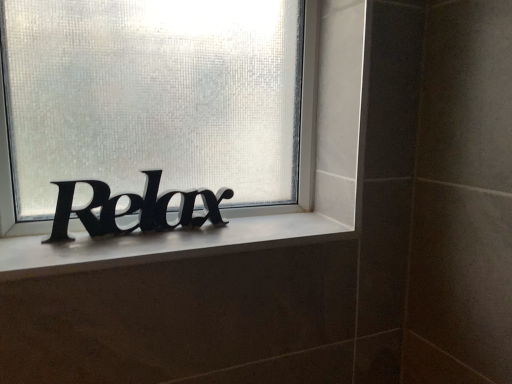
Question: Can you confirm if black matte lettering at center is thinner than black matte sign at center?

Choices:
 (A) no
 (B) yes

Answer: (B)

Question: Is black matte sign at center located within black matte lettering at center?

Choices:
 (A) no
 (B) yes

Answer: (A)

Question: Does black matte lettering at center lie in front of black matte sign at center?

Choices:
 (A) no
 (B) yes

Answer: (A)

Question: Considering the relative positions of black matte lettering at center and black matte sign at center in the image provided, is black matte lettering at center to the left of black matte sign at center from the viewer's perspective?

Choices:
 (A) yes
 (B) no

Answer: (A)

Question: Is the position of black matte lettering at center more distant than that of black matte sign at center?

Choices:
 (A) yes
 (B) no

Answer: (A)

Question: Considering the relative sizes of black matte lettering at center and black matte sign at center in the image provided, is black matte lettering at center wider than black matte sign at center?

Choices:
 (A) yes
 (B) no

Answer: (B)

Question: Is the position of white matte window sill at center more distant than that of black matte sign at center?

Choices:
 (A) no
 (B) yes

Answer: (A)

Question: Is white matte window sill at center thinner than black matte sign at center?

Choices:
 (A) no
 (B) yes

Answer: (A)

Question: Could you tell me if white matte window sill at center is turned towards black matte sign at center?

Choices:
 (A) yes
 (B) no

Answer: (B)

Question: From a real-world perspective, is white matte window sill at center beneath black matte sign at center?

Choices:
 (A) no
 (B) yes

Answer: (B)

Question: Considering the relative sizes of white matte window sill at center and black matte sign at center in the image provided, is white matte window sill at center smaller than black matte sign at center?

Choices:
 (A) no
 (B) yes

Answer: (B)

Question: Is white matte window sill at center shorter than black matte sign at center?

Choices:
 (A) yes
 (B) no

Answer: (A)

Question: Considering the relative sizes of white matte window sill at center and black matte lettering at center in the image provided, is white matte window sill at center bigger than black matte lettering at center?

Choices:
 (A) no
 (B) yes

Answer: (A)